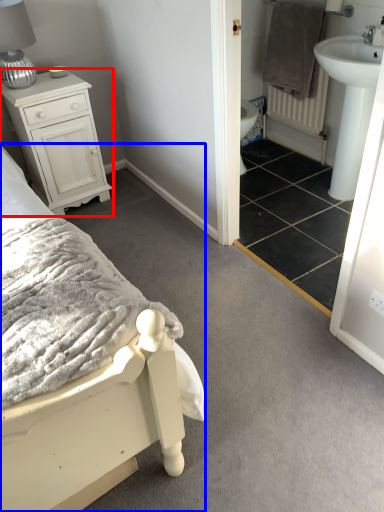
Question: Which point is closer to the camera, chest of drawers (highlighted by a red box) or bed (highlighted by a blue box)?

Choices:
 (A) chest of drawers
 (B) bed

Answer: (B)